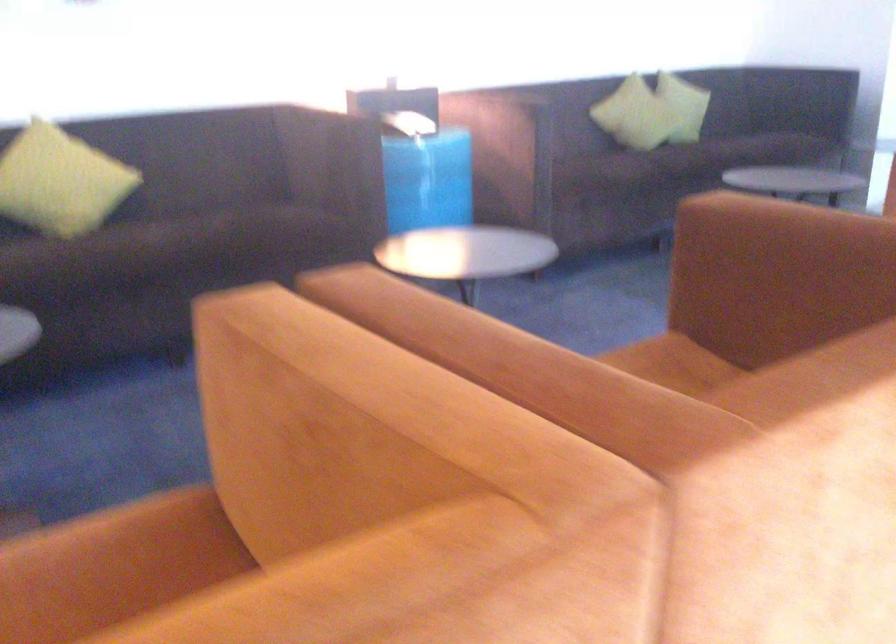
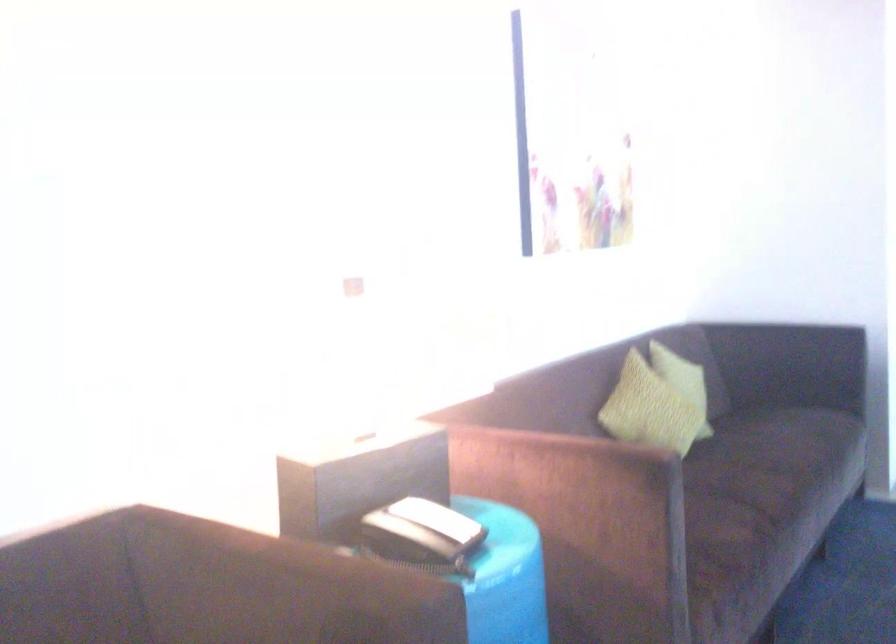
Where in the second image is the point corresponding to pixel 636 98 from the first image?

(648, 410)